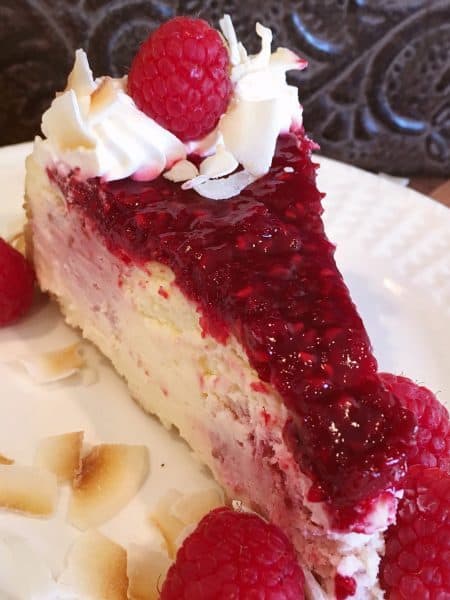
Image resolution: width=450 pixels, height=600 pixels. What are the coordinates of `floor` in the screenshot? It's located at (437, 189).